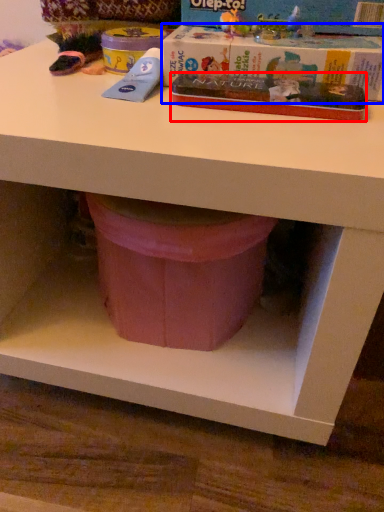
Question: Which point is further to the camera, paperback book (highlighted by a red box) or paperback book (highlighted by a blue box)?

Choices:
 (A) paperback book
 (B) paperback book

Answer: (B)